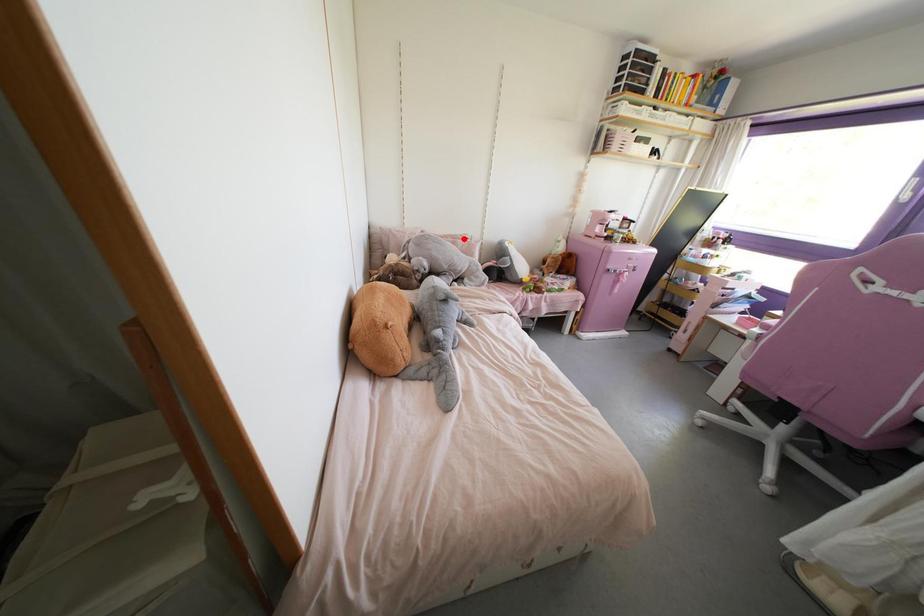
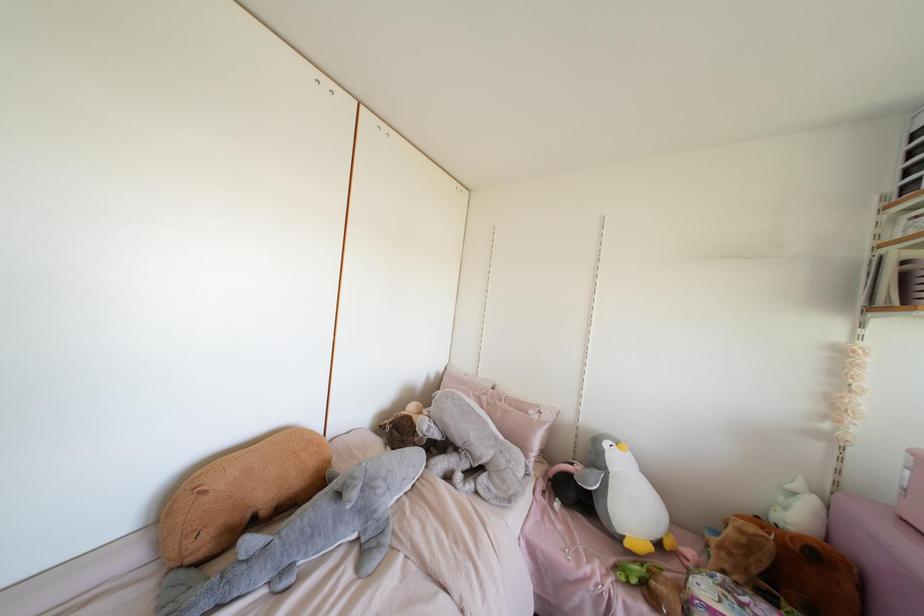
Question: I am providing you with two images of the same scene from different viewpoints. In image1, a red point is highlighted. Considering the same 3D point in image2, which of the following is correct?

Choices:
 (A) It is closer
 (B) It is farther

Answer: (B)